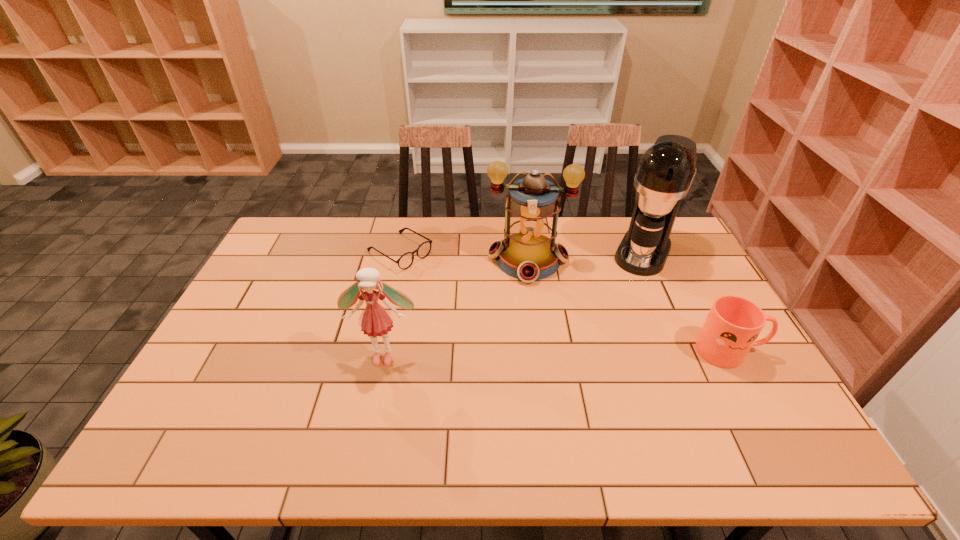
The height and width of the screenshot is (540, 960). I want to click on coffee maker located at the right edge, so click(x=665, y=172).

Find the location of a particular element. Image resolution: width=960 pixels, height=540 pixels. object positioned at the far right corner is located at coordinates coord(665,172).

This screenshot has width=960, height=540. Identify the location of vacant space at the far edge of the desktop. (333, 235).

Locate an element on the screen. The height and width of the screenshot is (540, 960). vacant space at the near edge is located at coordinates (339, 418).

Locate an element on the screen. free space at the left edge of the desktop is located at coordinates (263, 322).

Find the location of a particular element. This screenshot has width=960, height=540. unoccupied position between the fourth tallest object and the coffee maker is located at coordinates (686, 301).

Locate an element on the screen. The height and width of the screenshot is (540, 960). vacant space that's between the doll and the spectacles is located at coordinates (392, 304).

Image resolution: width=960 pixels, height=540 pixels. I want to click on free space between the doll and the mug, so click(557, 353).

Identify the location of free space between the mug and the doll. The image size is (960, 540). (557, 353).

Where is `free spot between the spectacles and the third object from left to right`? free spot between the spectacles and the third object from left to right is located at coordinates (464, 256).